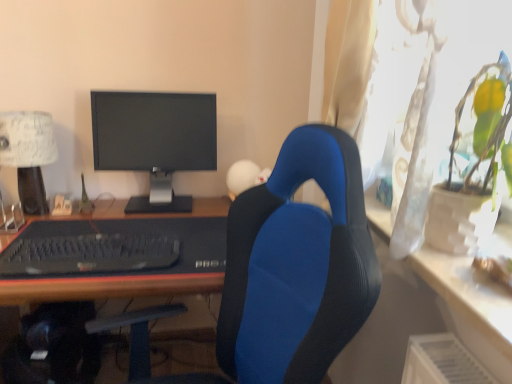
This screenshot has width=512, height=384. I want to click on vacant space situated above black matte keyboard at lower left (from a real-world perspective), so pyautogui.click(x=91, y=241).